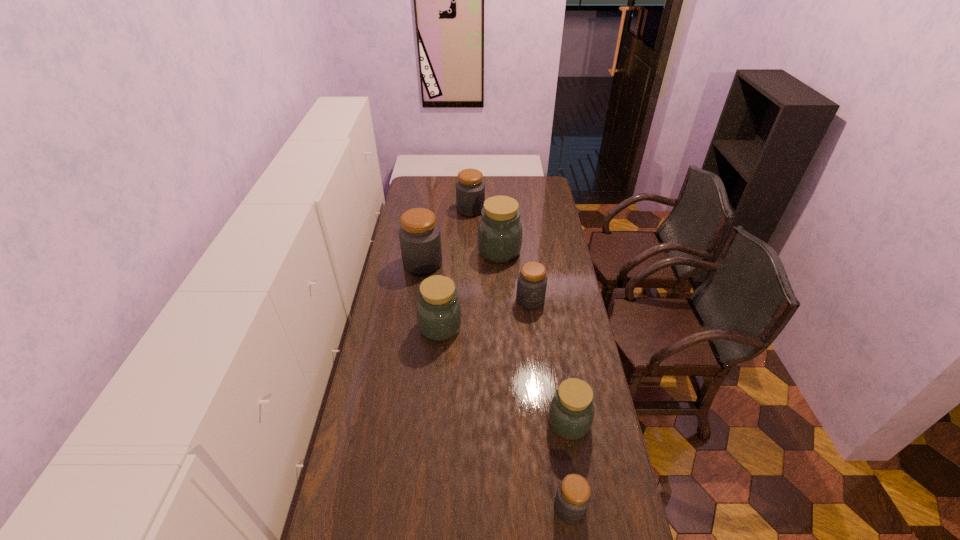
Locate which gray jar is the closest to the third nearest gray jar. Please provide its 2D coordinates. Your answer should be formatted as a tuple, i.e. [(x, y)], where the tuple contains the x and y coordinates of a point satisfying the conditions above.

[(470, 189)]

You are a GUI agent. You are given a task and a screenshot of the screen. Output one action in this format:
    pyautogui.click(x=<x>, y=<y>)
    Task: Click on the gray jar object that ranks as the third closest to the third smallest gray jar
    This screenshot has height=540, width=960.
    Given the screenshot: What is the action you would take?
    pyautogui.click(x=573, y=496)

Image resolution: width=960 pixels, height=540 pixels. I want to click on vacant space that satisfies the following two spatial constraints: 1. on the back side of the nearest green jar; 2. on the surface of the farthest jar near the warning symbol, so click(534, 210).

Identify the location of free spot that satisfies the following two spatial constraints: 1. on the surface of the rightmost green jar near the warning symbol; 2. on the left side of the second nearest gray jar. (545, 423).

This screenshot has height=540, width=960. Identify the location of free space that satisfies the following two spatial constraints: 1. on the surface of the second gray jar from left to right near the warning symbol; 2. on the right side of the biggest green jar. (469, 251).